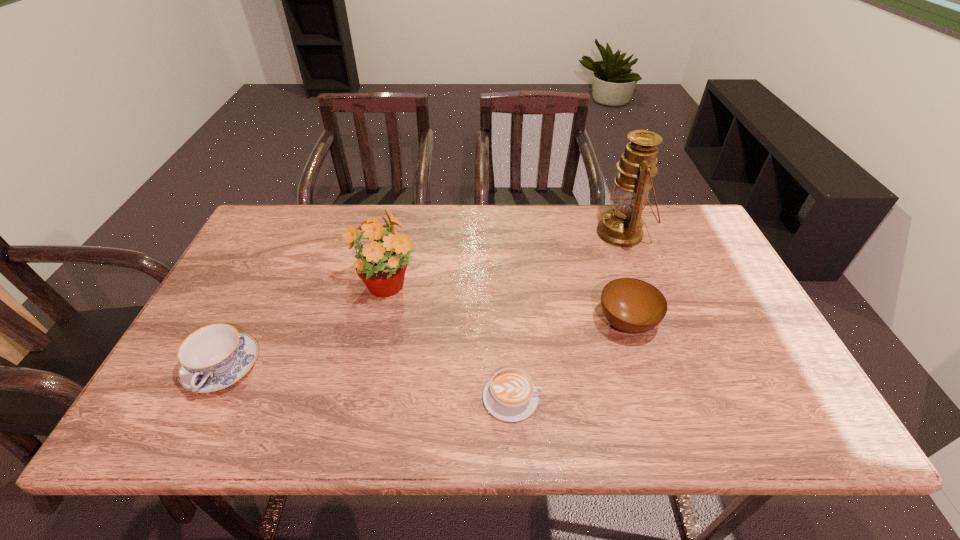
Locate an element on the screen. The image size is (960, 540). vacant space located on the left of the bowl is located at coordinates (549, 323).

Locate an element on the screen. free region located 0.080m with the handle on the side of the chinaware is located at coordinates [189, 436].

Locate an element on the screen. vacant area situated on the side of the third object from right to left with the handle is located at coordinates (717, 397).

Locate an element on the screen. The width and height of the screenshot is (960, 540). object that is at the far edge is located at coordinates (621, 226).

The height and width of the screenshot is (540, 960). Find the location of `chinaware that is at the near edge`. chinaware that is at the near edge is located at coordinates (214, 357).

This screenshot has width=960, height=540. What are the coordinates of `cappuccino that is at the near edge` in the screenshot? It's located at (510, 395).

This screenshot has height=540, width=960. In order to click on object that is at the left edge in this screenshot , I will do `click(214, 357)`.

The image size is (960, 540). I want to click on object that is at the near left corner, so click(214, 357).

This screenshot has width=960, height=540. In the image, there is a desktop. Find the location of `vacant space at the far edge`. vacant space at the far edge is located at coordinates (322, 218).

Where is `vacant region at the near edge`? vacant region at the near edge is located at coordinates point(231,415).